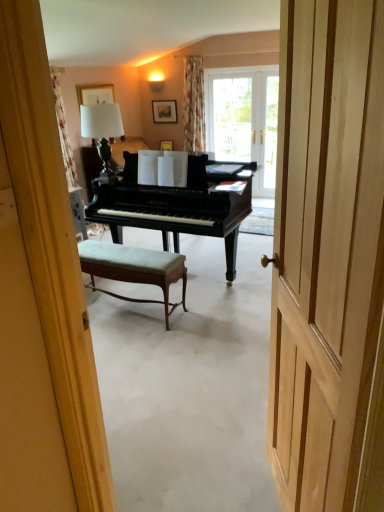
Question: Is wooden door at center in front of or behind velvet green stool at center in the image?

Choices:
 (A) front
 (B) behind

Answer: (A)

Question: Looking at their shapes, would you say wooden door at center is wider or thinner than velvet green stool at center?

Choices:
 (A) wide
 (B) thin

Answer: (B)

Question: Estimate the real-world distances between objects in this image. Which object is farther from the wooden picture frame at upper center, placed as the first picture frame when sorted from back to front?

Choices:
 (A) wooden door at center
 (B) velvet green stool at center
 (C) transparent glass door at upper center
 (D) shiny black piano at center
 (E) white fabric lampshade at upper center

Answer: (A)

Question: Which is farther from the shiny black piano at center?

Choices:
 (A) wooden picture frame at upper center, placed as the first picture frame when sorted from back to front
 (B) white fabric lampshade at upper center
 (C) velvet green stool at center
 (D) wooden door at center
 (E) matte wooden picture frame at upper center, the 2th picture frame in the right-to-left sequence

Answer: (A)